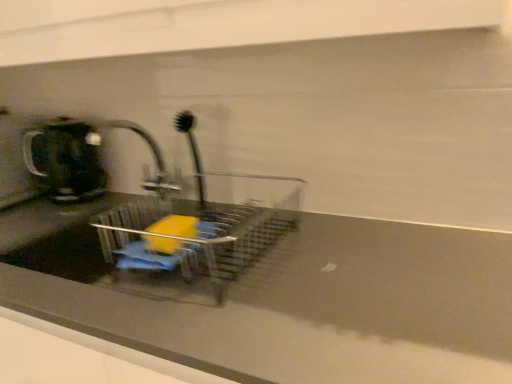
Find the location of a particular element. This screenshot has width=512, height=384. vacant space to the right of clear plastic sink at center is located at coordinates (367, 258).